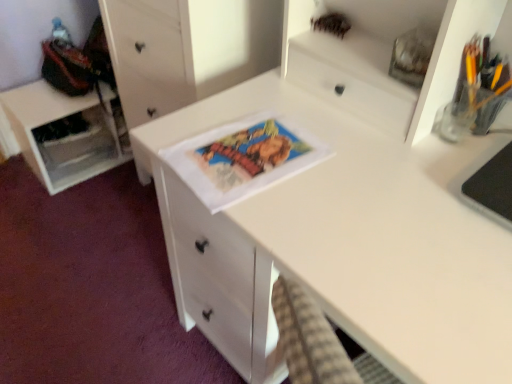
Question: Is white matte desk at center closer to the viewer compared to translucent glass pencil holder at upper right?

Choices:
 (A) no
 (B) yes

Answer: (B)

Question: Does white matte desk at center appear on the right side of translucent glass pencil holder at upper right?

Choices:
 (A) yes
 (B) no

Answer: (B)

Question: Is white matte desk at center next to translucent glass pencil holder at upper right and touching it?

Choices:
 (A) yes
 (B) no

Answer: (B)

Question: Is translucent glass pencil holder at upper right a part of white matte desk at center?

Choices:
 (A) no
 (B) yes

Answer: (A)

Question: Would you say white matte desk at center is a long distance from translucent glass pencil holder at upper right?

Choices:
 (A) yes
 (B) no

Answer: (B)

Question: Is white matte desk at center positioned beyond the bounds of translucent glass pencil holder at upper right?

Choices:
 (A) no
 (B) yes

Answer: (B)

Question: Is white matte chest of drawers at center completely or partially inside white matte cabinet at left?

Choices:
 (A) no
 (B) yes

Answer: (A)

Question: Can you confirm if white matte cabinet at left is positioned to the right of white matte chest of drawers at center?

Choices:
 (A) no
 (B) yes

Answer: (A)

Question: Is white matte cabinet at left positioned beyond the bounds of white matte chest of drawers at center?

Choices:
 (A) yes
 (B) no

Answer: (A)

Question: Does white matte cabinet at left have a lesser height compared to white matte chest of drawers at center?

Choices:
 (A) yes
 (B) no

Answer: (A)

Question: Is white matte cabinet at left positioned far away from white matte chest of drawers at center?

Choices:
 (A) yes
 (B) no

Answer: (B)

Question: Can you see white matte cabinet at left touching white matte chest of drawers at center?

Choices:
 (A) no
 (B) yes

Answer: (A)

Question: Does matte paper comic book at center lie behind white matte cabinet at left?

Choices:
 (A) yes
 (B) no

Answer: (B)